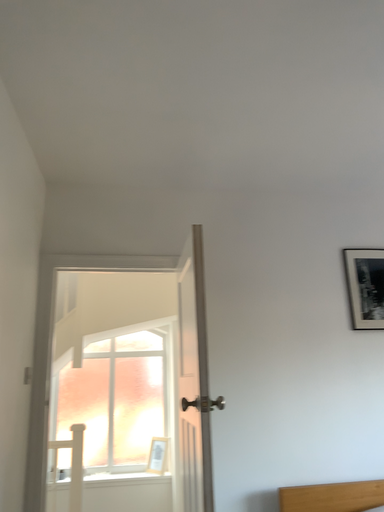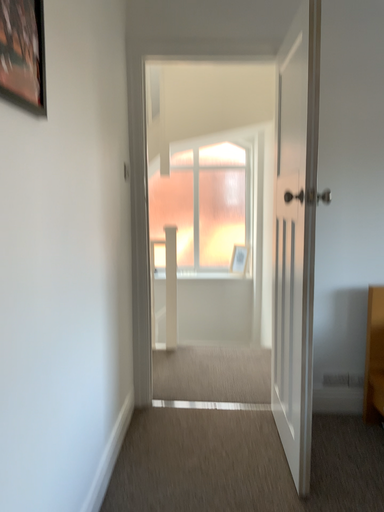
Question: How did the camera likely rotate when shooting the video?

Choices:
 (A) rotated right
 (B) rotated left

Answer: (B)